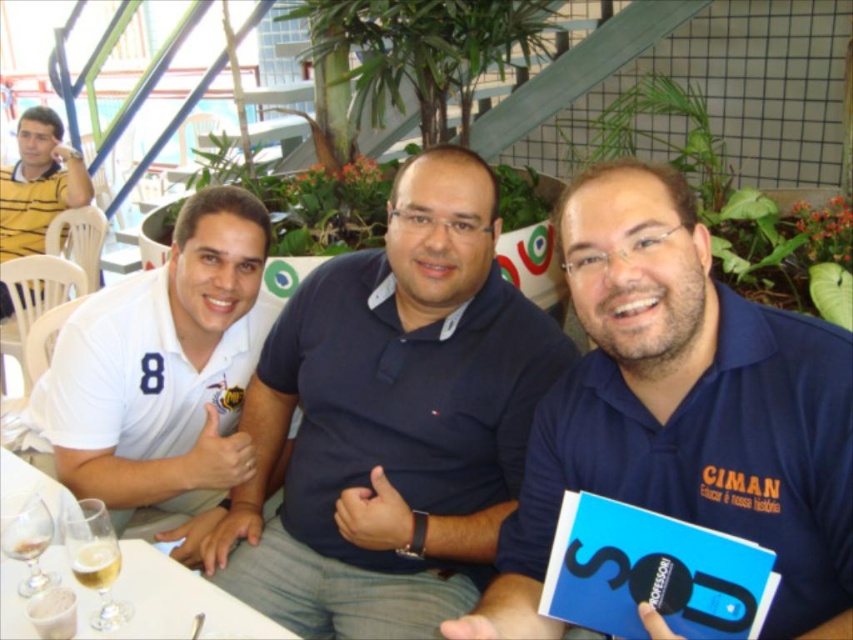
Question: Considering the real-world distances, which object is closest to the yellow striped shirt at upper left?

Choices:
 (A) white glossy table at lower left
 (B) blue cotton shirt at center
 (C) white matte polo shirt at left
 (D) blue matte shirt at center

Answer: (C)

Question: Does blue cotton shirt at center appear on the right side of white glossy table at lower left?

Choices:
 (A) no
 (B) yes

Answer: (B)

Question: Which object is farther from the camera taking this photo?

Choices:
 (A) white matte polo shirt at left
 (B) yellow striped shirt at upper left
 (C) white glossy table at lower left

Answer: (B)

Question: Is blue cotton shirt at center below white matte polo shirt at left?

Choices:
 (A) yes
 (B) no

Answer: (A)

Question: Which of the following is the closest to the observer?

Choices:
 (A) click(x=207, y=298)
 (B) click(x=426, y=515)
 (C) click(x=820, y=444)
 (D) click(x=7, y=198)

Answer: (C)

Question: Is white matte polo shirt at left wider than white glossy table at lower left?

Choices:
 (A) no
 (B) yes

Answer: (B)